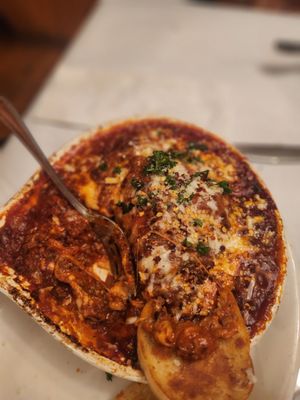
Identify the location of fork. Image resolution: width=300 pixels, height=400 pixels. (92, 220).